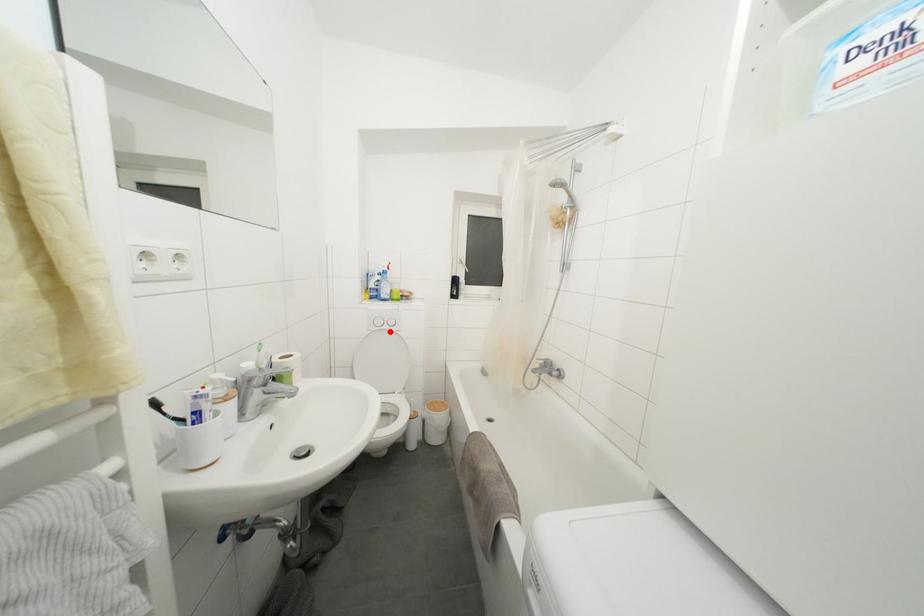
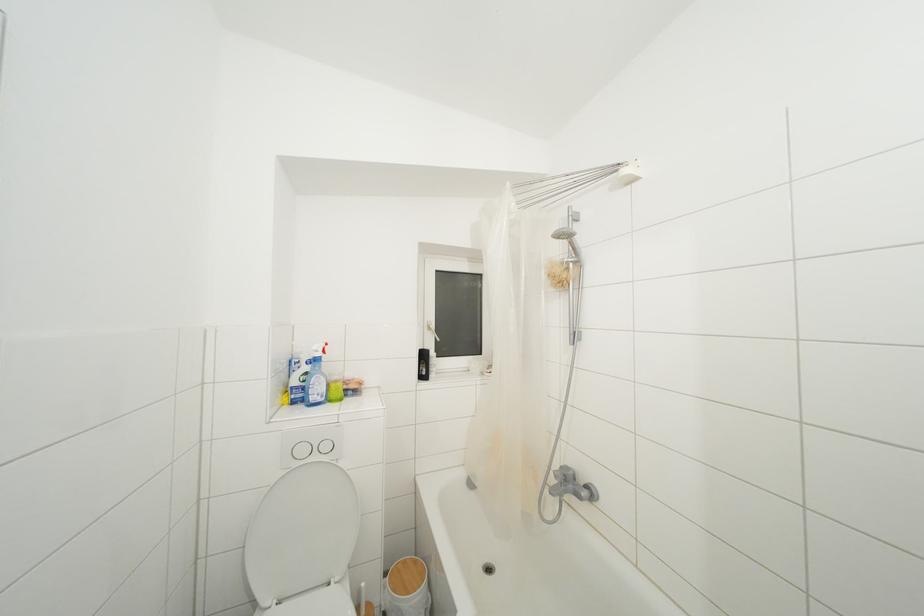
In the second image, find the point that corresponds to the highlighted location in the first image.

(320, 463)